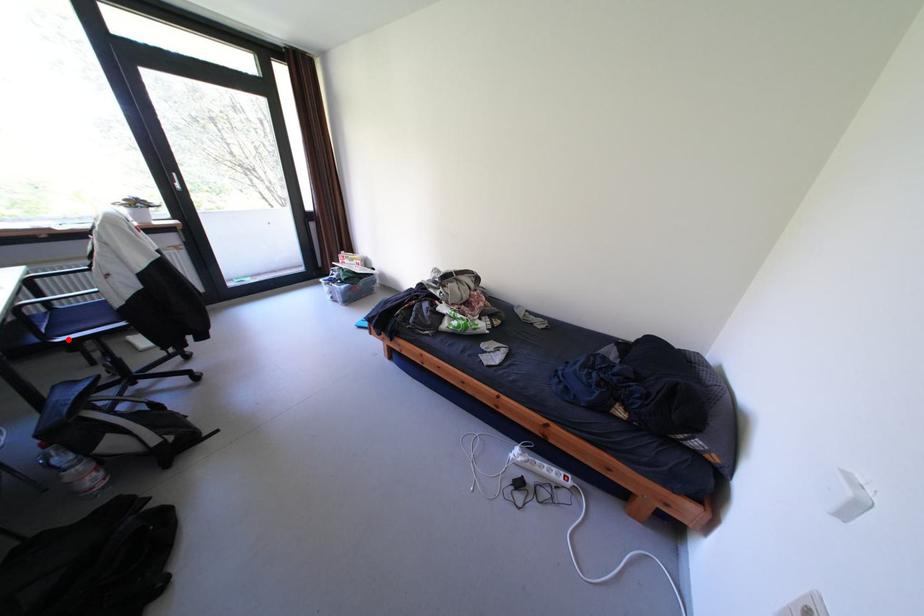
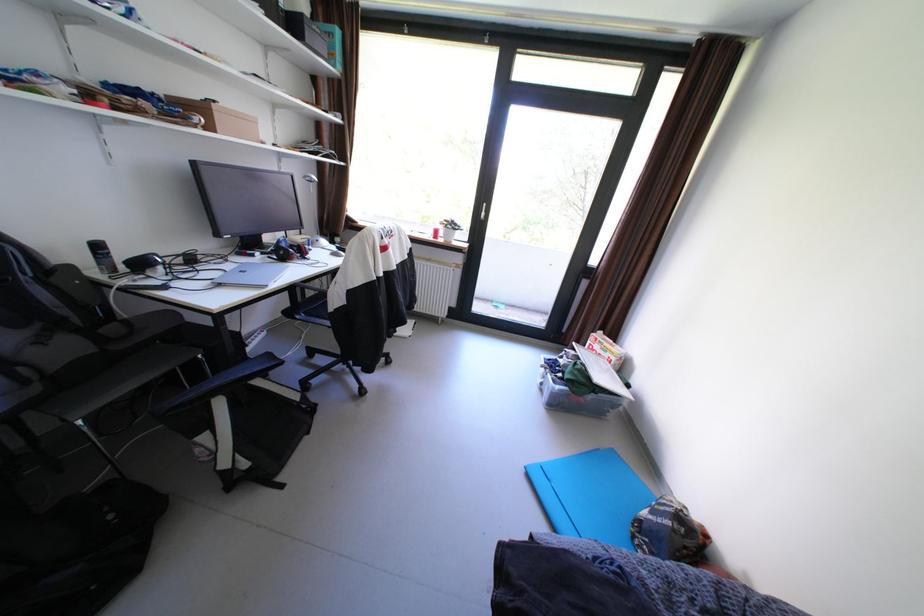
Question: I am providing you with two images of the same scene from different viewpoints. In image1, a red point is highlighted. Considering the same 3D point in image2, which of the following is correct?

Choices:
 (A) It is closer
 (B) It is farther

Answer: (A)